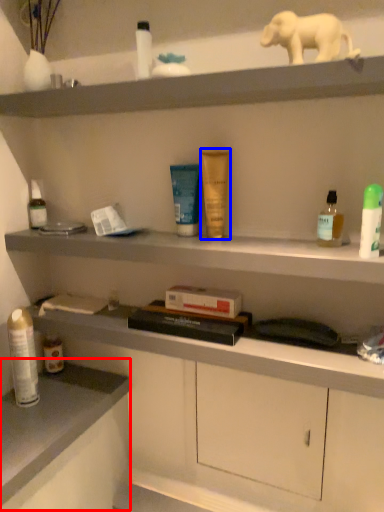
Question: Among these objects, which one is farthest to the camera, counter top (highlighted by a red box) or toiletry (highlighted by a blue box)?

Choices:
 (A) counter top
 (B) toiletry

Answer: (B)